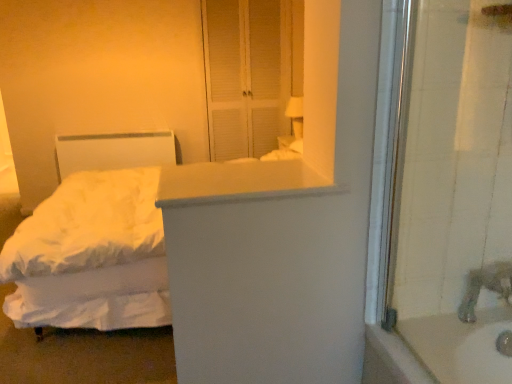
Identify the location of free point above white matte counter top at center (from a real-world perspective). Image resolution: width=512 pixels, height=384 pixels. (245, 163).